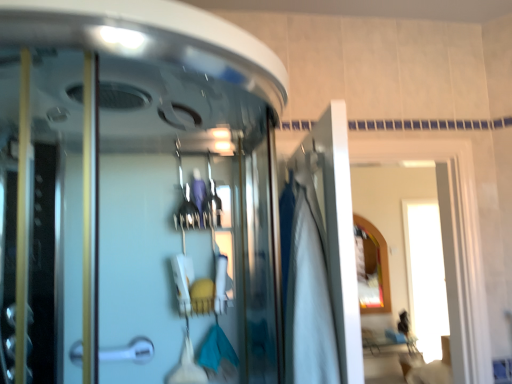
Question: Does transparent glass shower door at center have a lesser width compared to white fabric at center?

Choices:
 (A) no
 (B) yes

Answer: (A)

Question: Is transparent glass shower door at center located outside white fabric at center?

Choices:
 (A) no
 (B) yes

Answer: (B)

Question: Is transparent glass shower door at center at the left side of white fabric at center?

Choices:
 (A) no
 (B) yes

Answer: (B)

Question: Is transparent glass shower door at center positioned in front of white fabric at center?

Choices:
 (A) no
 (B) yes

Answer: (B)

Question: From the image's perspective, is transparent glass shower door at center located above white fabric at center?

Choices:
 (A) no
 (B) yes

Answer: (B)

Question: Is transparent glass shower door at center taller or shorter than silver metallic door handle at lower left?

Choices:
 (A) short
 (B) tall

Answer: (B)

Question: From a real-world perspective, is transparent glass shower door at center positioned above or below silver metallic door handle at lower left?

Choices:
 (A) below
 (B) above

Answer: (B)

Question: Relative to silver metallic door handle at lower left, is transparent glass shower door at center in front or behind?

Choices:
 (A) behind
 (B) front

Answer: (B)

Question: From the image's perspective, is transparent glass shower door at center located above or below silver metallic door handle at lower left?

Choices:
 (A) below
 (B) above

Answer: (B)

Question: Is silver metallic door handle at lower left inside the boundaries of white glossy door at upper right, or outside?

Choices:
 (A) outside
 (B) inside

Answer: (A)

Question: From the image's perspective, is silver metallic door handle at lower left above or below white glossy door at upper right?

Choices:
 (A) above
 (B) below

Answer: (B)

Question: From a real-world perspective, is silver metallic door handle at lower left physically located above or below white glossy door at upper right?

Choices:
 (A) above
 (B) below

Answer: (B)

Question: In the image, is silver metallic door handle at lower left on the left side or the right side of white glossy door at upper right?

Choices:
 (A) right
 (B) left

Answer: (B)

Question: Is white fabric at center in front of or behind matte gold mirror at upper right in the image?

Choices:
 (A) front
 (B) behind

Answer: (A)

Question: Visually, is white fabric at center positioned to the left or to the right of matte gold mirror at upper right?

Choices:
 (A) right
 (B) left

Answer: (B)